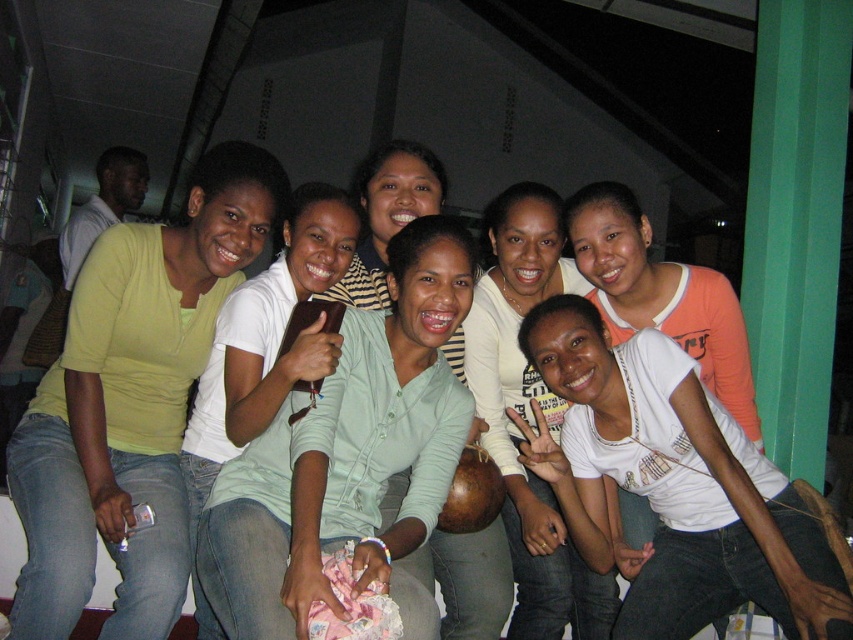
Question: Does white matte shirt at center have a lesser width compared to white cotton shirt at center?

Choices:
 (A) no
 (B) yes

Answer: (B)

Question: Does matte green shirt at center have a lesser width compared to white cotton shirt at center?

Choices:
 (A) no
 (B) yes

Answer: (B)

Question: Does white cotton shirt at center lie in front of green matte shirt at center?

Choices:
 (A) yes
 (B) no

Answer: (B)

Question: Estimate the real-world distances between objects in this image. Which object is farther from the green matte shirt at center?

Choices:
 (A) matte green shirt at center
 (B) white matte shirt at center
 (C) matte yellow shirt at left
 (D) white cotton shirt at center

Answer: (D)

Question: Which point appears farthest from the camera in this image?

Choices:
 (A) (170, 468)
 (B) (401, 337)

Answer: (A)

Question: Which object appears farthest from the camera in this image?

Choices:
 (A) matte green shirt at center
 (B) green matte shirt at center

Answer: (A)